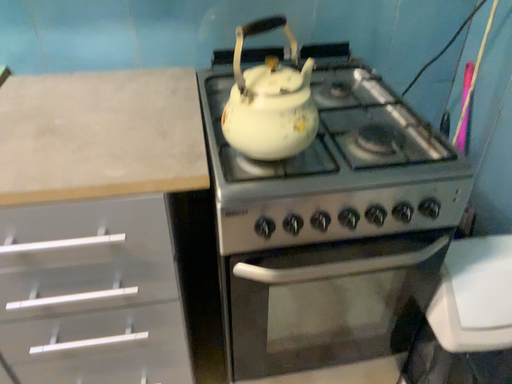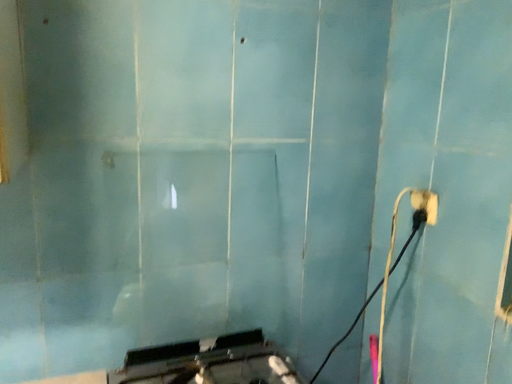
Question: Which way did the camera rotate in the video?

Choices:
 (A) rotated right
 (B) rotated left

Answer: (A)